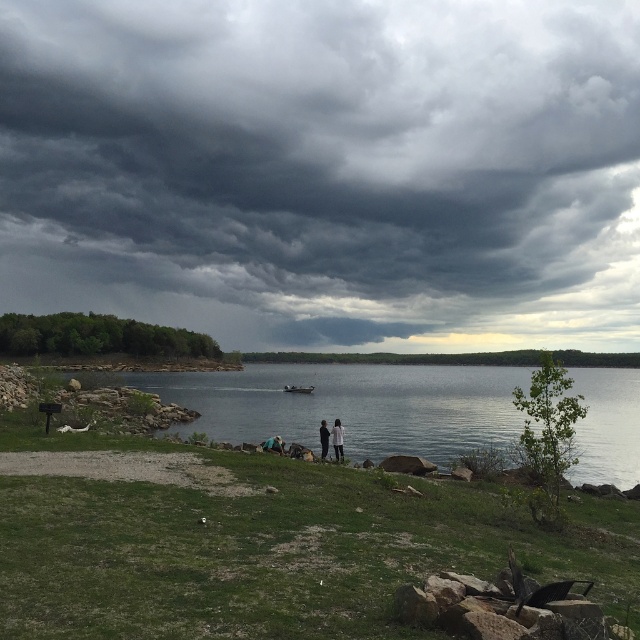
Question: Does dark blue jeans at center come in front of metallic gray boat at center?

Choices:
 (A) yes
 (B) no

Answer: (A)

Question: Is dark gray cloud at upper center smaller than dark blue jeans at center?

Choices:
 (A) no
 (B) yes

Answer: (A)

Question: Which of the following is the closest to the observer?

Choices:
 (A) (262, 221)
 (B) (333, 428)
 (C) (333, 428)

Answer: (C)

Question: Which object is the farthest from the metallic gray boat at center?

Choices:
 (A) dark gray cloud at upper center
 (B) dark blue jeans at center
 (C) dark gray fabric couple at center

Answer: (A)

Question: Which of the following is the closest to the observer?

Choices:
 (A) dark blue jeans at center
 (B) dark gray fabric couple at center
 (C) metallic gray boat at center

Answer: (A)

Question: Can you confirm if dark gray cloud at upper center is positioned to the left of light brown leather jacket at center?

Choices:
 (A) no
 (B) yes

Answer: (B)